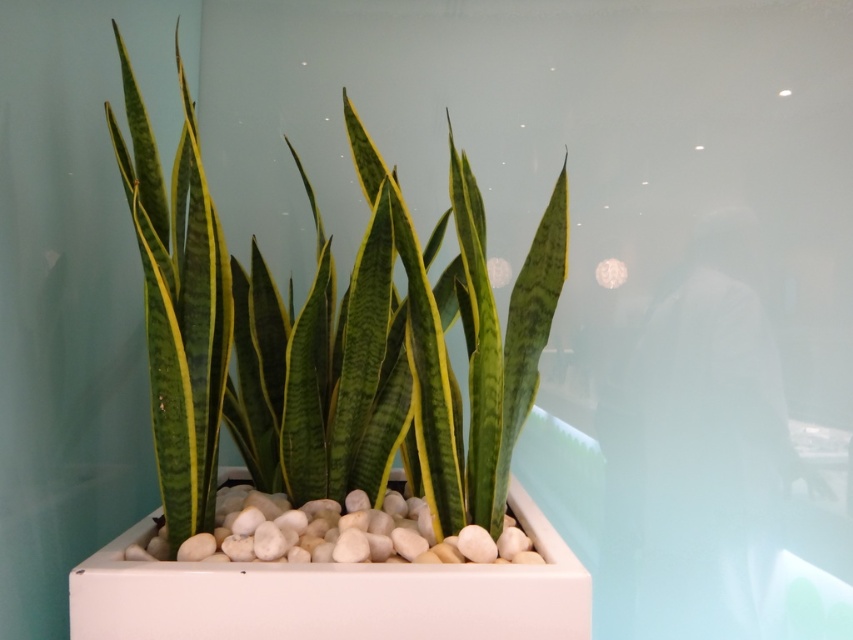
Question: Which object appears closest to the camera in this image?

Choices:
 (A) green textured leaves at center
 (B) green glossy leaves at center

Answer: (A)

Question: Among these points, which one is farthest from the camera?

Choices:
 (A) (450, 428)
 (B) (198, 296)

Answer: (A)

Question: Which of the following is the closest to the observer?

Choices:
 (A) click(338, 385)
 (B) click(169, 240)

Answer: (B)

Question: Does green glossy leaves at center appear under green textured leaves at center?

Choices:
 (A) yes
 (B) no

Answer: (A)

Question: Does green glossy leaves at center appear over green textured leaves at center?

Choices:
 (A) no
 (B) yes

Answer: (A)

Question: Where is green glossy leaves at center located in relation to green textured leaves at center in the image?

Choices:
 (A) above
 (B) below

Answer: (B)